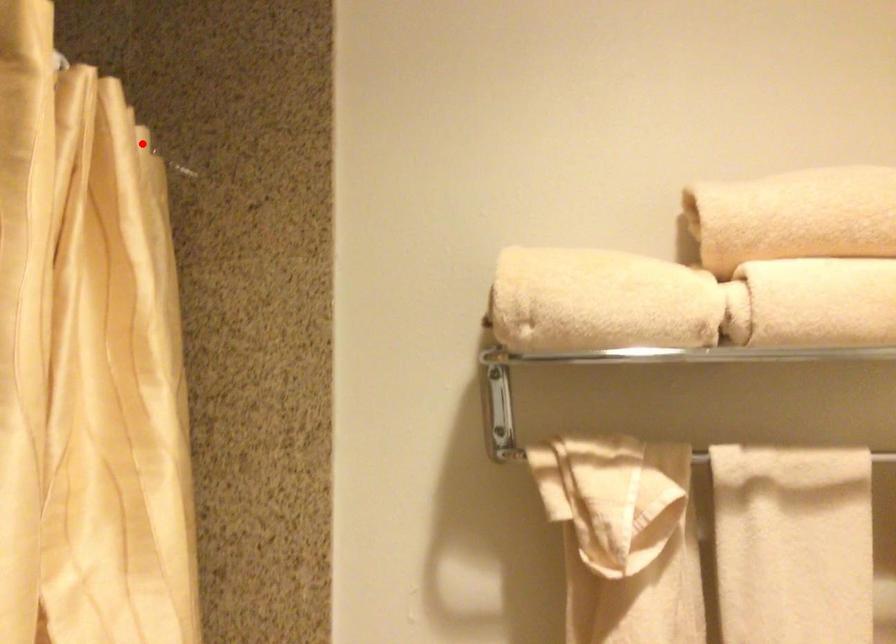
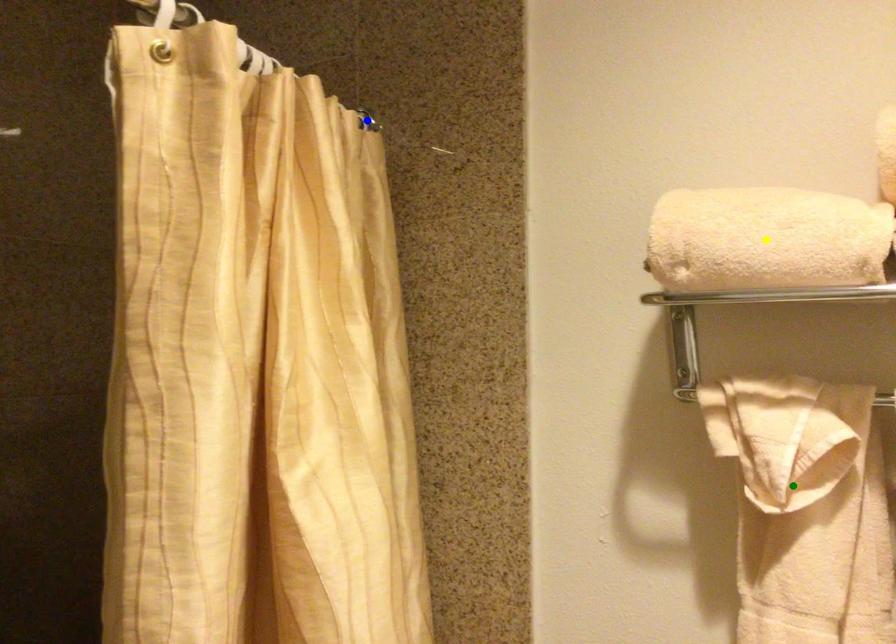
Question: I am providing you with two images of the same scene from different viewpoints. A red point is marked on the first image. You are given multiple points on the second image. Which point in image 2 is actually the same real-world point as the red point in image 1?

Choices:
 (A) green point
 (B) yellow point
 (C) blue point

Answer: (C)